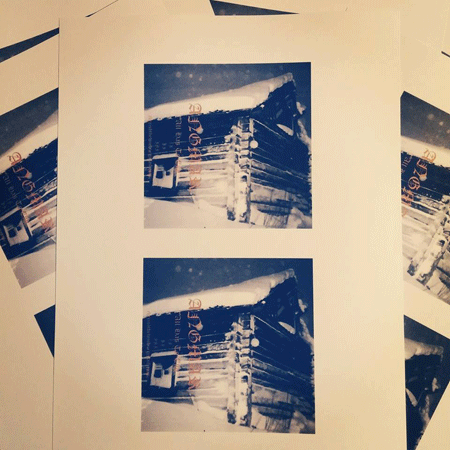
Identify the location of snow on window panes. (159, 380).